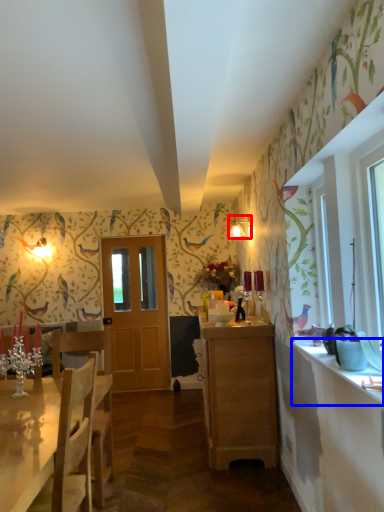
Question: Which point is further to the camera, lamp (highlighted by a red box) or counter top (highlighted by a blue box)?

Choices:
 (A) lamp
 (B) counter top

Answer: (A)